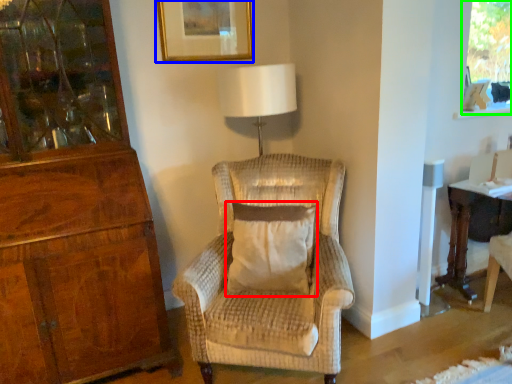
Question: Which object is positioned farthest from pillow (highlighted by a red box)? Select from picture frame (highlighted by a blue box) and window screen (highlighted by a green box).

Choices:
 (A) picture frame
 (B) window screen

Answer: (B)